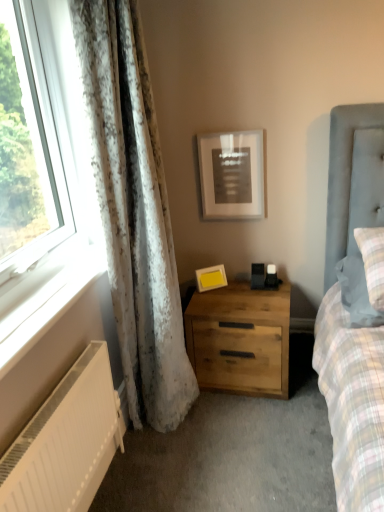
Question: Is plaid fabric pillow at right bigger than natural wood nightstand at center?

Choices:
 (A) no
 (B) yes

Answer: (A)

Question: Is plaid fabric pillow at right to the left of natural wood nightstand at center from the viewer's perspective?

Choices:
 (A) yes
 (B) no

Answer: (B)

Question: Is plaid fabric pillow at right facing away from natural wood nightstand at center?

Choices:
 (A) no
 (B) yes

Answer: (A)

Question: Is plaid fabric pillow at right shorter than natural wood nightstand at center?

Choices:
 (A) no
 (B) yes

Answer: (B)

Question: Is plaid fabric pillow at right facing towards natural wood nightstand at center?

Choices:
 (A) yes
 (B) no

Answer: (B)

Question: Choose the correct answer: Is white matte radiator at lower left inside white textured curtain at left or outside it?

Choices:
 (A) inside
 (B) outside

Answer: (B)

Question: In the image, is white matte radiator at lower left on the left side or the right side of white textured curtain at left?

Choices:
 (A) left
 (B) right

Answer: (A)

Question: From the image's perspective, is white matte radiator at lower left above or below white textured curtain at left?

Choices:
 (A) below
 (B) above

Answer: (A)

Question: From a real-world perspective, is white matte radiator at lower left physically located above or below white textured curtain at left?

Choices:
 (A) above
 (B) below

Answer: (B)

Question: From the image's perspective, is plaid fabric pillow at right located above or below matte black picture frame at upper center, acting as the first picture frame starting from the top?

Choices:
 (A) above
 (B) below

Answer: (B)

Question: Based on their sizes in the image, would you say plaid fabric pillow at right is bigger or smaller than matte black picture frame at upper center, acting as the first picture frame starting from the top?

Choices:
 (A) big
 (B) small

Answer: (A)

Question: Considering their positions, is plaid fabric pillow at right located in front of or behind matte black picture frame at upper center, the second picture frame ordered from the bottom?

Choices:
 (A) behind
 (B) front

Answer: (B)

Question: Considering the positions of plaid fabric pillow at right and matte black picture frame at upper center, acting as the first picture frame starting from the top, in the image, is plaid fabric pillow at right taller or shorter than matte black picture frame at upper center, acting as the first picture frame starting from the top,?

Choices:
 (A) short
 (B) tall

Answer: (A)

Question: In terms of width, does white painted wood at lower left look wider or thinner when compared to white textured curtain at left?

Choices:
 (A) wide
 (B) thin

Answer: (B)

Question: Relative to white textured curtain at left, is white painted wood at lower left in front or behind?

Choices:
 (A) behind
 (B) front

Answer: (B)